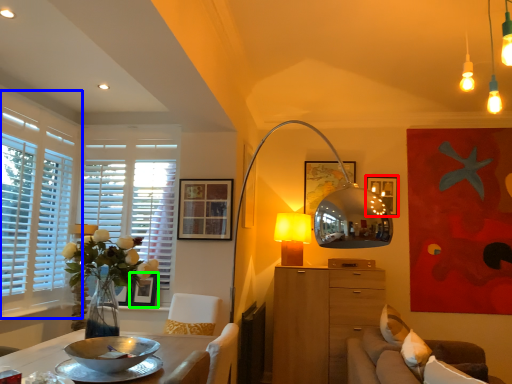
Question: Based on their relative distances, which object is nearer to picture frame (highlighted by a red box)? Choose from window (highlighted by a blue box) and picture frame (highlighted by a green box).

Choices:
 (A) window
 (B) picture frame

Answer: (B)